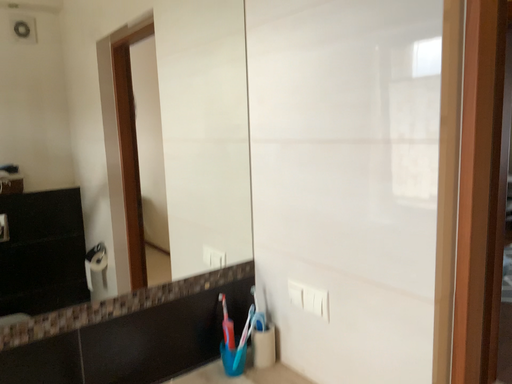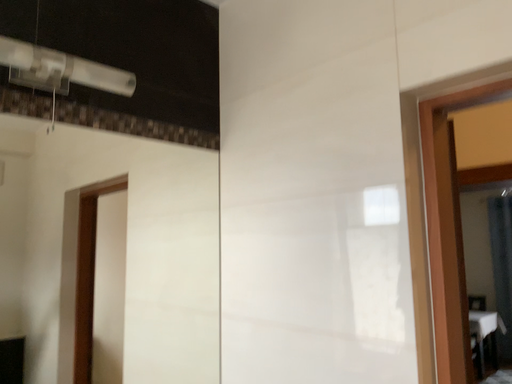
Question: Which way did the camera rotate in the video?

Choices:
 (A) rotated downward
 (B) rotated upward

Answer: (B)